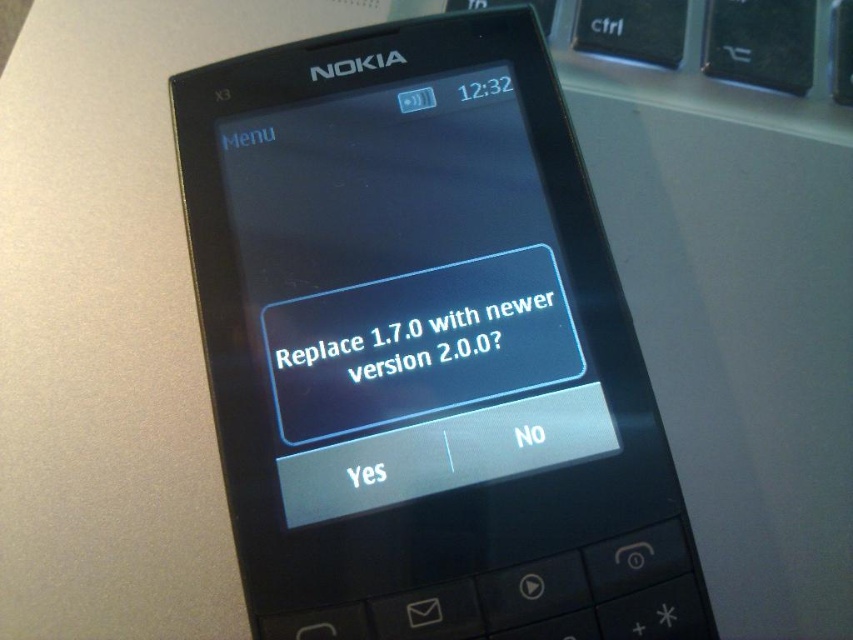
Question: Considering the relative positions of matte black screen at center and black matte text at center in the image provided, where is matte black screen at center located with respect to black matte text at center?

Choices:
 (A) left
 (B) right

Answer: (A)

Question: Can you confirm if matte black screen at center is positioned below black matte text at center?

Choices:
 (A) no
 (B) yes

Answer: (A)

Question: Considering the relative positions of matte black screen at center and black matte text at center in the image provided, where is matte black screen at center located with respect to black matte text at center?

Choices:
 (A) right
 (B) left

Answer: (B)

Question: Which point appears farthest from the camera in this image?

Choices:
 (A) (426, 362)
 (B) (492, 90)

Answer: (B)

Question: Which point appears farthest from the camera in this image?

Choices:
 (A) (538, 352)
 (B) (294, 179)

Answer: (B)